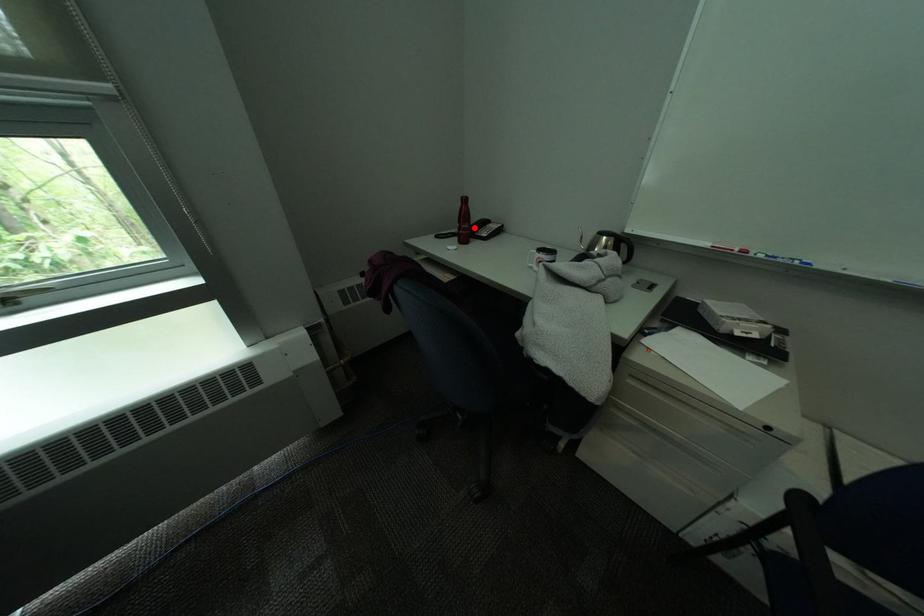
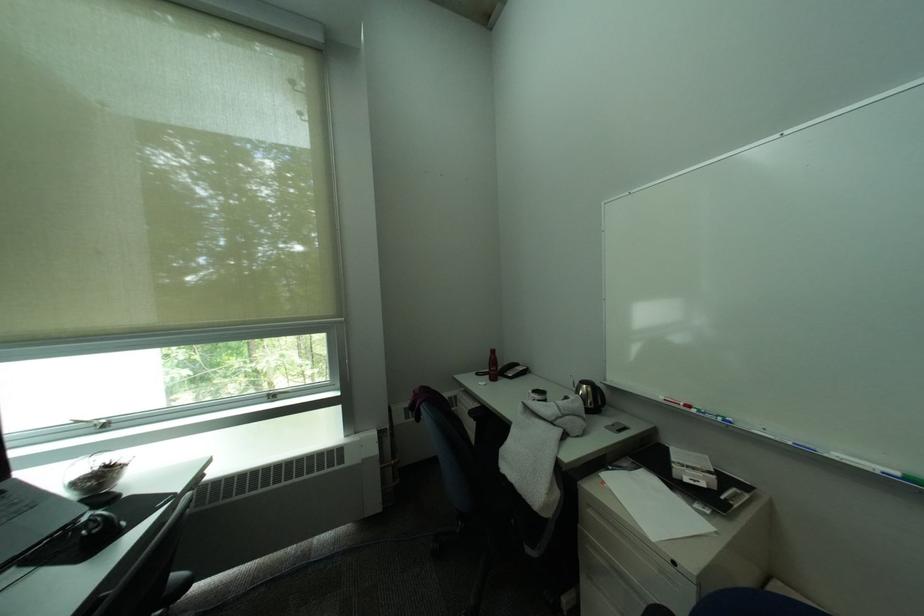
Question: I am providing you with two images of the same scene from different viewpoints. A red point is marked on the first image. Is the red point's position out of view in image 2?

Choices:
 (A) Yes
 (B) No

Answer: (B)